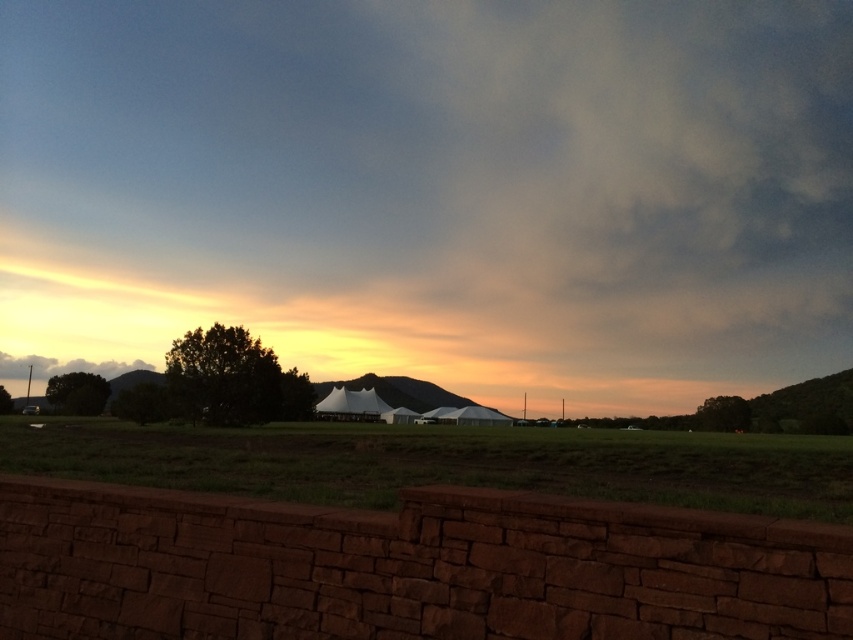
Question: Does white fabric tent at center appear over green grass at center?

Choices:
 (A) no
 (B) yes

Answer: (B)

Question: From the image, what is the correct spatial relationship of white fabric tent at center in relation to green grass at center?

Choices:
 (A) above
 (B) below

Answer: (A)

Question: Observing the image, what is the correct spatial positioning of white fabric tent at center in reference to green grass at center?

Choices:
 (A) below
 (B) above

Answer: (B)

Question: Which object appears closest to the camera in this image?

Choices:
 (A) white fabric tent at center
 (B) green grass at center

Answer: (B)